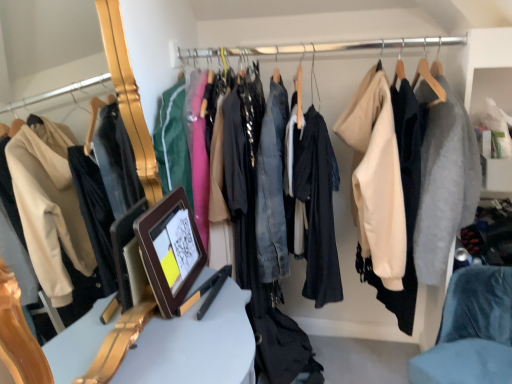
Question: Does brown wooden picture frame at center have a lesser width compared to white glossy table at center?

Choices:
 (A) no
 (B) yes

Answer: (B)

Question: Does brown wooden picture frame at center have a greater width compared to white glossy table at center?

Choices:
 (A) yes
 (B) no

Answer: (B)

Question: Does brown wooden picture frame at center have a larger size compared to white glossy table at center?

Choices:
 (A) no
 (B) yes

Answer: (A)

Question: Is brown wooden picture frame at center not within white glossy table at center?

Choices:
 (A) no
 (B) yes

Answer: (B)

Question: Is brown wooden picture frame at center positioned in front of white glossy table at center?

Choices:
 (A) no
 (B) yes

Answer: (A)

Question: Considering their positions, is velvet blue chair at lower right located in front of or behind brown wooden picture frame at center?

Choices:
 (A) front
 (B) behind

Answer: (B)

Question: From a real-world perspective, is velvet blue chair at lower right above or below brown wooden picture frame at center?

Choices:
 (A) above
 (B) below

Answer: (B)

Question: From their relative heights in the image, would you say velvet blue chair at lower right is taller or shorter than brown wooden picture frame at center?

Choices:
 (A) tall
 (B) short

Answer: (A)

Question: Which is correct: velvet blue chair at lower right is inside brown wooden picture frame at center, or outside of it?

Choices:
 (A) outside
 (B) inside

Answer: (A)

Question: Visually, is white glossy table at center positioned to the left or to the right of brown wooden picture frame at center?

Choices:
 (A) right
 (B) left

Answer: (A)

Question: From the image's perspective, is white glossy table at center positioned above or below brown wooden picture frame at center?

Choices:
 (A) below
 (B) above

Answer: (A)

Question: In terms of width, does white glossy table at center look wider or thinner when compared to brown wooden picture frame at center?

Choices:
 (A) thin
 (B) wide

Answer: (B)

Question: In terms of height, does white glossy table at center look taller or shorter compared to brown wooden picture frame at center?

Choices:
 (A) tall
 (B) short

Answer: (A)

Question: Would you say white glossy table at center is inside or outside velvet blue chair at lower right?

Choices:
 (A) outside
 (B) inside

Answer: (A)

Question: Considering the positions of white glossy table at center and velvet blue chair at lower right in the image, is white glossy table at center wider or thinner than velvet blue chair at lower right?

Choices:
 (A) wide
 (B) thin

Answer: (B)